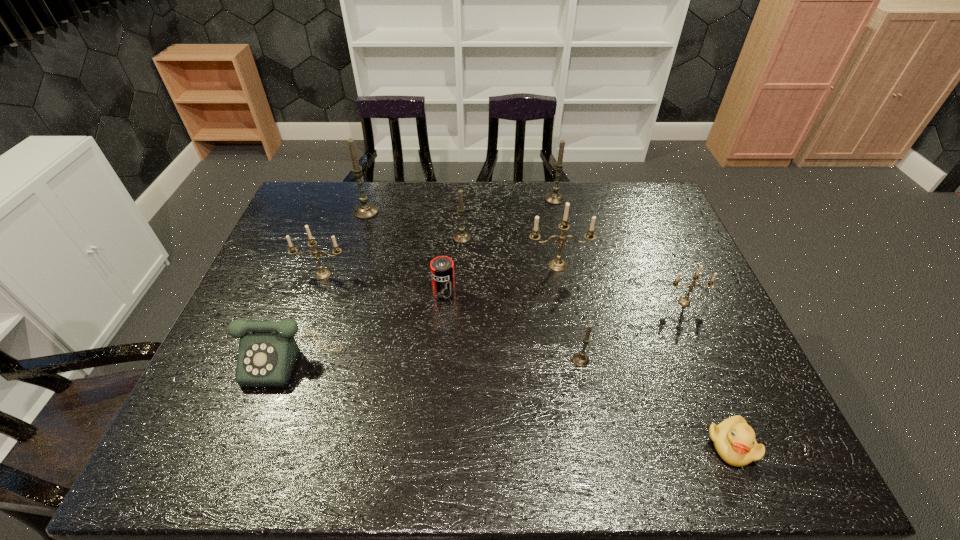
Image resolution: width=960 pixels, height=540 pixels. Find the location of `the smallest metallic candle`. the smallest metallic candle is located at coordinates (685, 301).

Locate an element on the screen. Image resolution: width=960 pixels, height=540 pixels. can is located at coordinates (442, 267).

This screenshot has height=540, width=960. In order to click on telephone in this screenshot , I will do `click(267, 354)`.

The image size is (960, 540). In order to click on the nearest object in this screenshot , I will do `click(734, 440)`.

Locate an element on the screen. The width and height of the screenshot is (960, 540). yellow duckling is located at coordinates (734, 440).

Find the location of a particular element. Image resolution: width=960 pixels, height=540 pixels. vacant space located 0.290m on the front of the biggest gray candle is located at coordinates (345, 282).

Find the location of a particular element. The image size is (960, 540). blank area located on the right of the second biggest gray candle is located at coordinates (662, 199).

Where is `vacant space located 0.350m on the front of the second metallic candle from left to right`? This screenshot has height=540, width=960. vacant space located 0.350m on the front of the second metallic candle from left to right is located at coordinates (578, 377).

You are a GUI agent. You are given a task and a screenshot of the screen. Output one action in this format:
    pyautogui.click(x=<x>, y=<y>)
    Task: Click on the vacant space located on the front of the third farthest gray candle
    
    Given the screenshot: What is the action you would take?
    pyautogui.click(x=462, y=254)

Image resolution: width=960 pixels, height=540 pixels. Find the location of `vacant space located on the back of the leftmost metallic candle`. vacant space located on the back of the leftmost metallic candle is located at coordinates (334, 245).